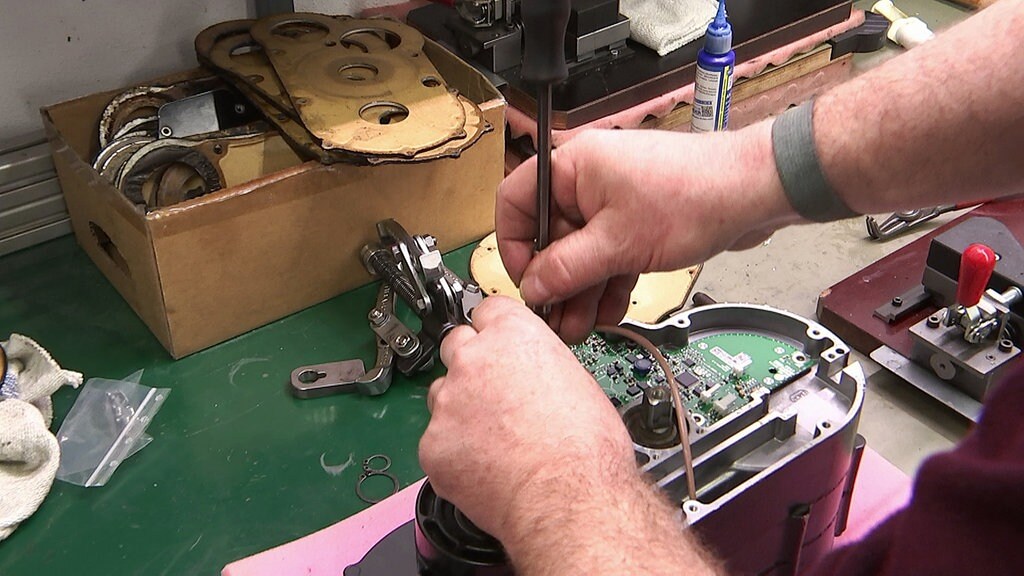
At what (x,y) coordinates should I click in order to perform the action: click on green table. Please return your answer as a coordinate pair (x, y). Image resolution: width=1024 pixels, height=576 pixels. Looking at the image, I should click on (240, 439).